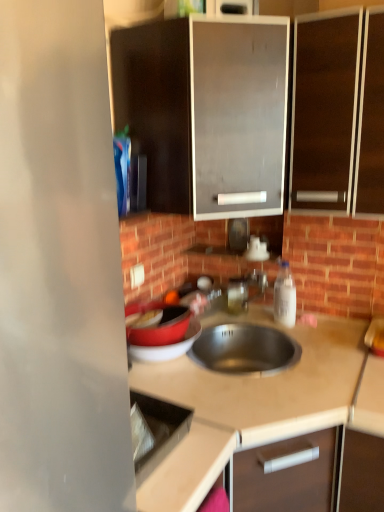
Question: Is white plastic electric outlet at upper center facing towards white plastic bottle at right?

Choices:
 (A) no
 (B) yes

Answer: (A)

Question: Considering the relative sizes of white plastic electric outlet at upper center and white plastic bottle at right in the image provided, is white plastic electric outlet at upper center thinner than white plastic bottle at right?

Choices:
 (A) no
 (B) yes

Answer: (B)

Question: Are white plastic electric outlet at upper center and white plastic bottle at right far apart?

Choices:
 (A) no
 (B) yes

Answer: (A)

Question: Is the position of white plastic electric outlet at upper center more distant than that of white plastic bottle at right?

Choices:
 (A) no
 (B) yes

Answer: (A)

Question: Is white plastic electric outlet at upper center next to white plastic bottle at right and touching it?

Choices:
 (A) no
 (B) yes

Answer: (A)

Question: In terms of height, does beige laminate countertop at center look taller or shorter compared to matte black cabinet at upper center, which is the 1th cabinetry in left-to-right order?

Choices:
 (A) short
 (B) tall

Answer: (B)

Question: Based on their sizes in the image, would you say beige laminate countertop at center is bigger or smaller than matte black cabinet at upper center, which is the 1th cabinetry in left-to-right order?

Choices:
 (A) big
 (B) small

Answer: (A)

Question: In terms of width, does beige laminate countertop at center look wider or thinner when compared to matte black cabinet at upper center, which is the 1th cabinetry in left-to-right order?

Choices:
 (A) wide
 (B) thin

Answer: (A)

Question: Is beige laminate countertop at center inside or outside of matte black cabinet at upper center, which is the 1th cabinetry in left-to-right order?

Choices:
 (A) outside
 (B) inside

Answer: (A)

Question: From the image's perspective, is white plastic bottle at right positioned above or below dark wood cabinet at upper right, the second cabinetry viewed from the left?

Choices:
 (A) below
 (B) above

Answer: (A)

Question: Considering the positions of white plastic bottle at right and dark wood cabinet at upper right, the second cabinetry viewed from the left, in the image, is white plastic bottle at right bigger or smaller than dark wood cabinet at upper right, the second cabinetry viewed from the left,?

Choices:
 (A) big
 (B) small

Answer: (B)

Question: Looking at their shapes, would you say white plastic bottle at right is wider or thinner than dark wood cabinet at upper right, the first cabinetry from the right?

Choices:
 (A) wide
 (B) thin

Answer: (B)

Question: From a real-world perspective, is white plastic bottle at right above or below dark wood cabinet at upper right, the first cabinetry from the right?

Choices:
 (A) below
 (B) above

Answer: (A)

Question: From their relative heights in the image, would you say white plastic electric outlet at upper center is taller or shorter than matte black cabinet at upper center, which is the 1th cabinetry in left-to-right order?

Choices:
 (A) short
 (B) tall

Answer: (A)

Question: Relative to matte black cabinet at upper center, the second cabinetry from the right, is white plastic electric outlet at upper center in front or behind?

Choices:
 (A) front
 (B) behind

Answer: (B)